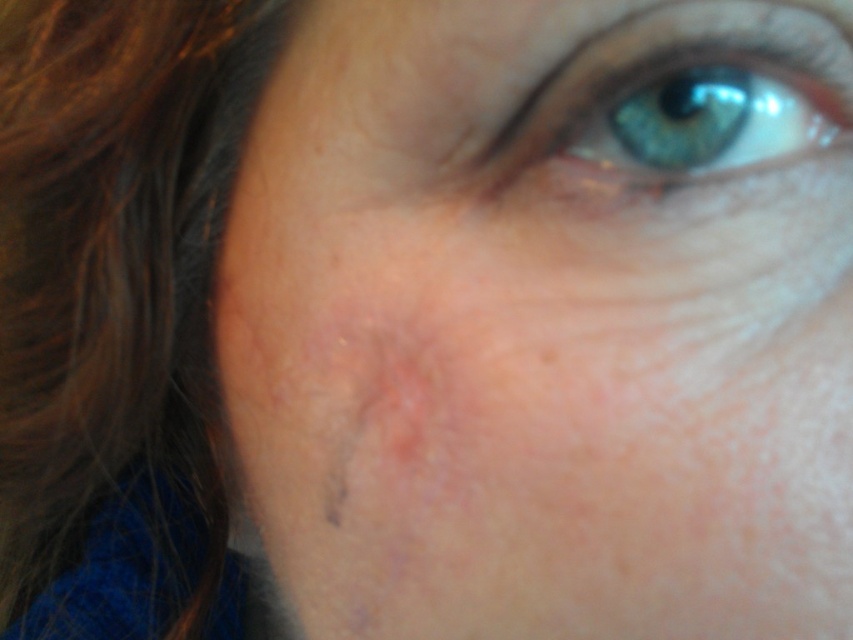
Between brown silky hair at left and blue iridescent eye at upper center, which one has more height?

With more height is brown silky hair at left.

Is point (113, 257) positioned behind point (604, 76)?

That is True.

Which is in front, point (230, 28) or point (683, 52)?

Point (683, 52)

This screenshot has width=853, height=640. I want to click on brown silky hair at left, so click(114, 266).